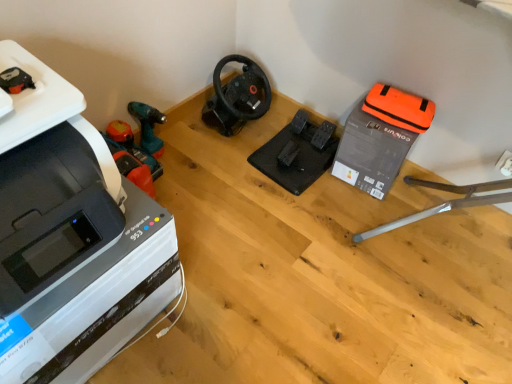
The width and height of the screenshot is (512, 384). I want to click on free location in front of orange fabric bag at upper right, which appears as the second equipment when viewed from the left, so click(x=365, y=216).